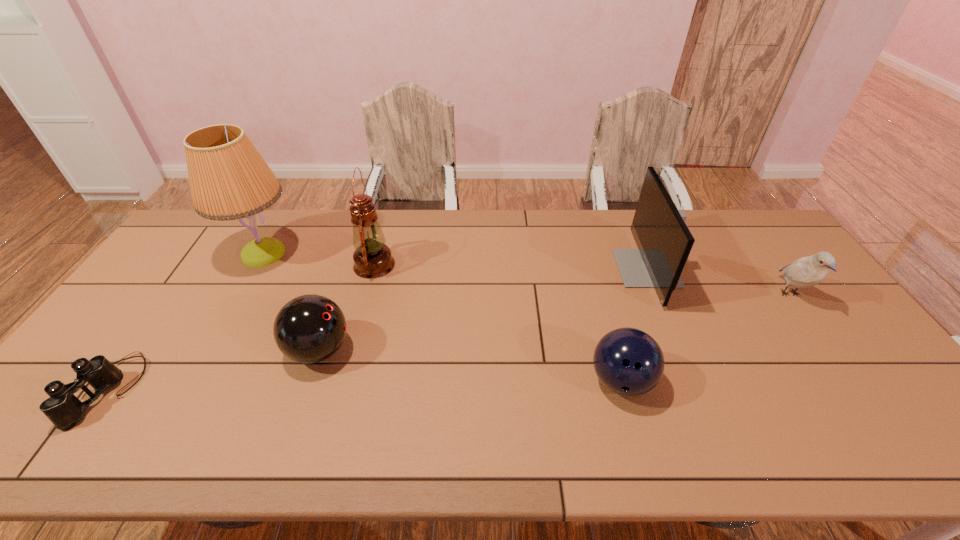
The height and width of the screenshot is (540, 960). Identify the location of lamp. (229, 180).

Where is `the second object from left to right`? the second object from left to right is located at coordinates (229, 180).

At what (x,y) coordinates should I click in order to perform the action: click on oil lamp. Please return your answer as a coordinate pair (x, y). Looking at the image, I should click on (372, 258).

This screenshot has height=540, width=960. What are the coordinates of `the second object from right to left` in the screenshot? It's located at (664, 241).

Locate an element on the screen. The width and height of the screenshot is (960, 540). the fifth shortest object is located at coordinates (664, 241).

Where is `bird`? This screenshot has width=960, height=540. bird is located at coordinates (805, 272).

Where is `the left bowling ball`? This screenshot has width=960, height=540. the left bowling ball is located at coordinates (310, 328).

Where is `the third object from right to left`? The width and height of the screenshot is (960, 540). the third object from right to left is located at coordinates (629, 362).

Identify the location of the leftmost object. This screenshot has height=540, width=960. (62, 408).

Where is `the shortest object`? Image resolution: width=960 pixels, height=540 pixels. the shortest object is located at coordinates (62, 408).